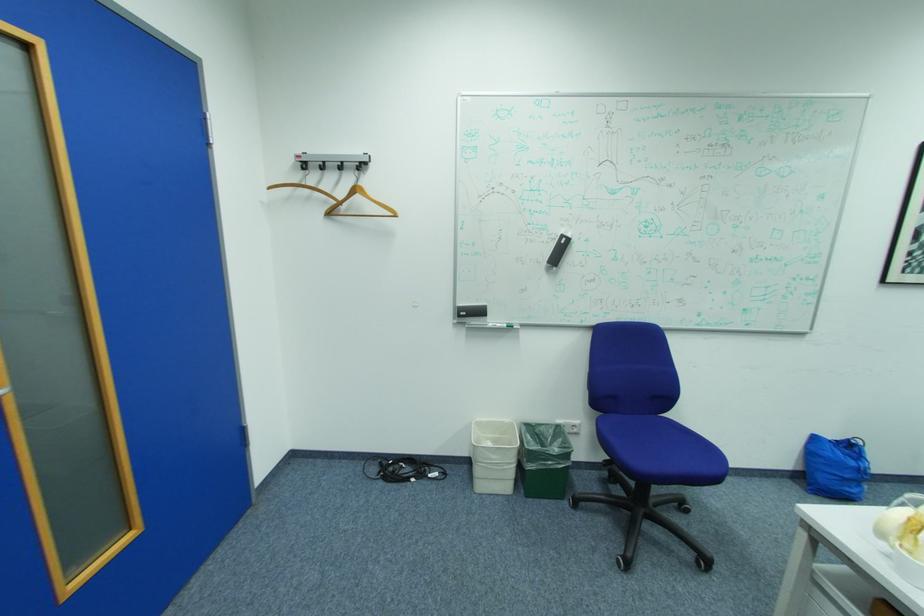
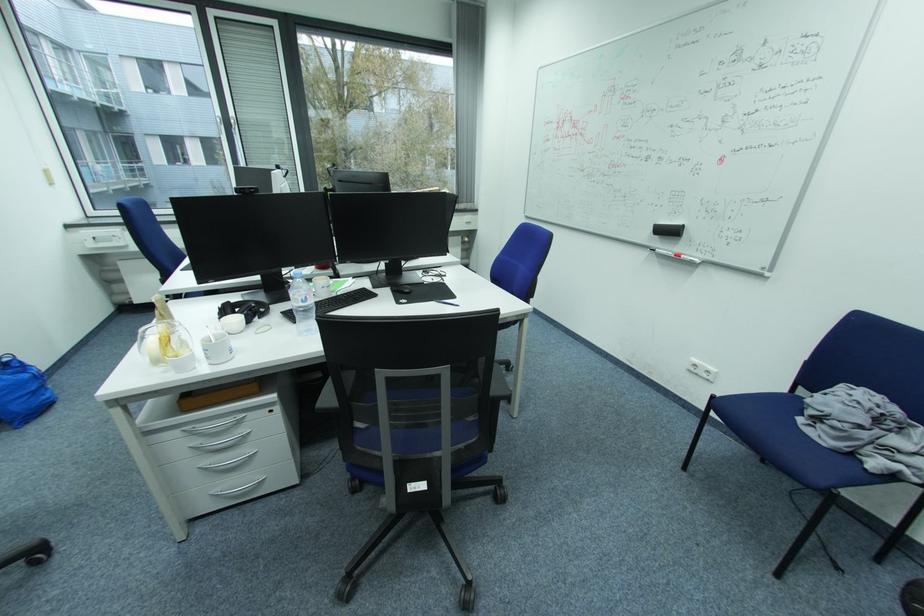
The point at (x=839, y=456) is marked in the first image. Where is the corresponding point in the second image?

(9, 385)